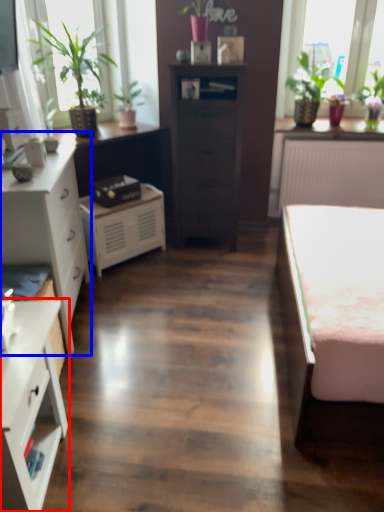
Question: Which point is closer to the camera, chest of drawers (highlighted by a red box) or chest of drawers (highlighted by a blue box)?

Choices:
 (A) chest of drawers
 (B) chest of drawers

Answer: (A)